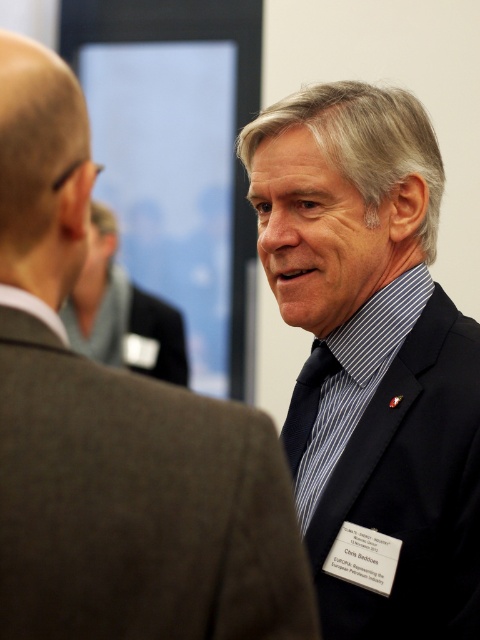
Question: From the image, what is the correct spatial relationship of blue striped shirt at center in relation to matte black suit at center?

Choices:
 (A) right
 (B) left

Answer: (A)

Question: Is matte black suit at right positioned at the back of blue striped shirt at center?

Choices:
 (A) yes
 (B) no

Answer: (B)

Question: Which of the following is the farthest from the observer?

Choices:
 (A) matte black suit at center
 (B) matte black suit at right
 (C) blue striped shirt at center

Answer: (A)

Question: Which point is farther to the camera?

Choices:
 (A) (148, 321)
 (B) (324, 353)
 (C) (240, 545)

Answer: (A)

Question: Which object is farther from the camera taking this photo?

Choices:
 (A) blue striped shirt at center
 (B) matte black suit at center
 (C) dark blue silk tie at center
 (D) matte black suit at right

Answer: (B)

Question: Is blue striped shirt at center positioned in front of dark blue silk tie at center?

Choices:
 (A) yes
 (B) no

Answer: (A)